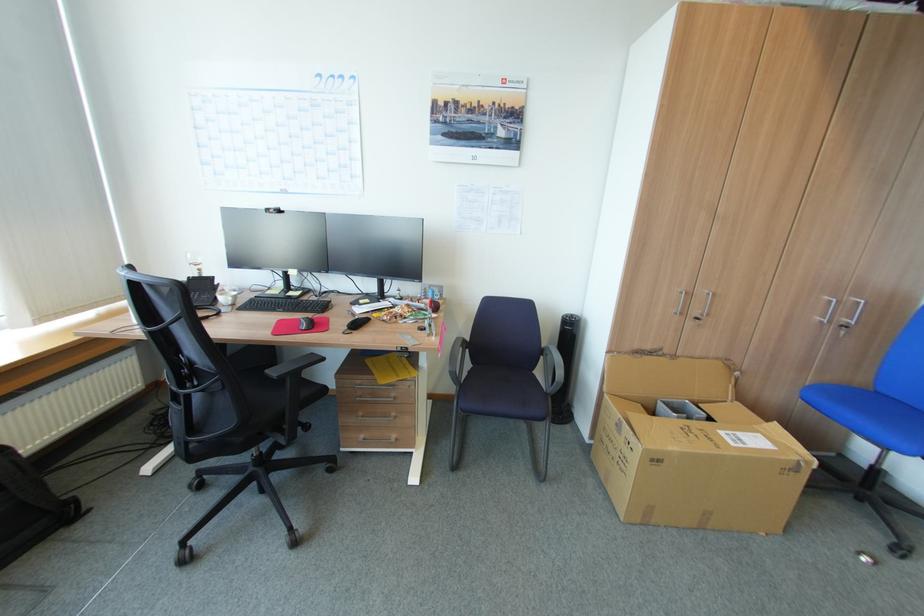
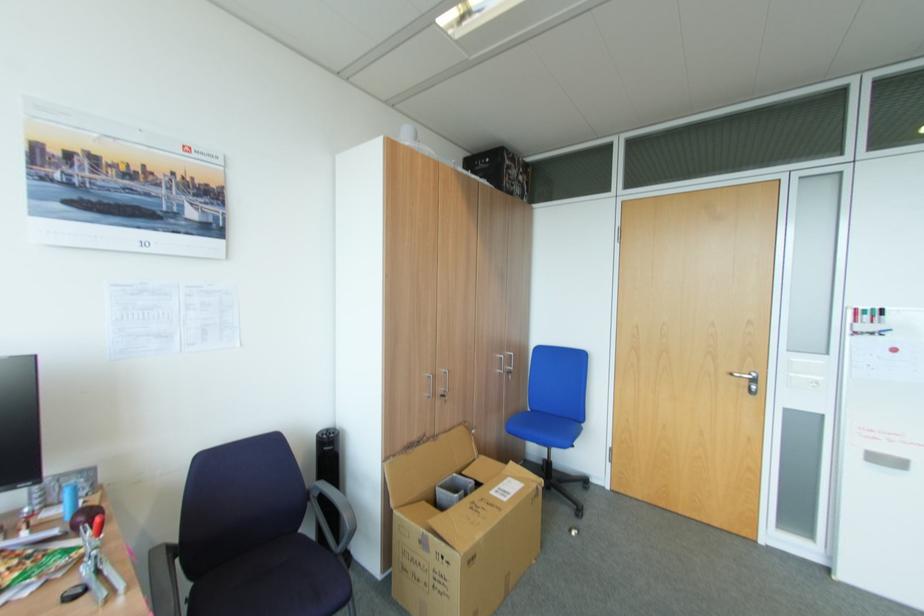
In the second image, find the point that corresponds to point (687, 313) in the first image.

(440, 394)